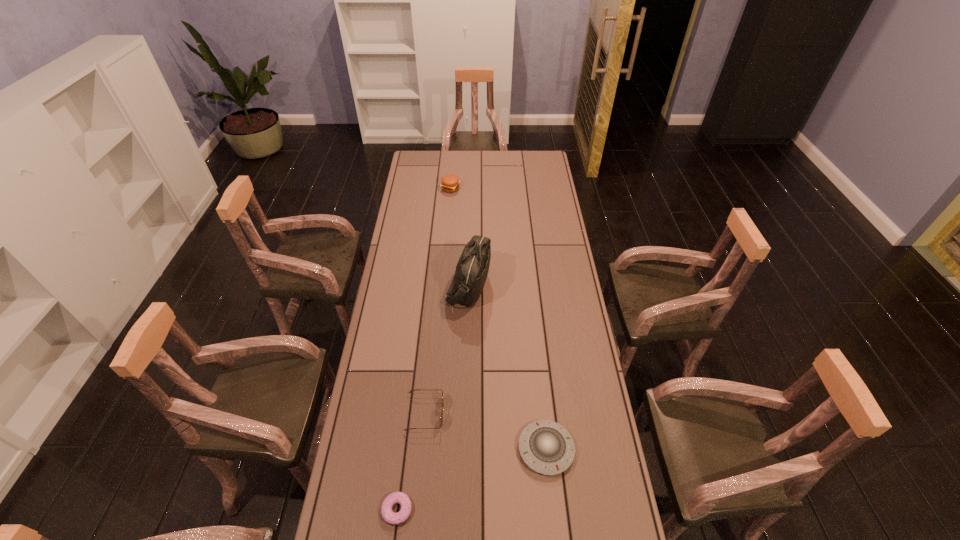
Where is `vacant space located on the lenses of the sunglasses`? vacant space located on the lenses of the sunglasses is located at coordinates (510, 413).

You are a GUI agent. You are given a task and a screenshot of the screen. Output one action in this format:
    pyautogui.click(x=<x>, y=<y>)
    Task: Click on the blank space located 0.140m on the back of the saucer
    The image size is (960, 540).
    Given the screenshot: What is the action you would take?
    pyautogui.click(x=540, y=385)

This screenshot has height=540, width=960. I want to click on vacant space located 0.060m on the back of the doughnut, so click(401, 472).

What are the coordinates of `sunglasses situated at the left edge` in the screenshot? It's located at (441, 417).

This screenshot has height=540, width=960. Find the location of `doughnut positioned at the left edge`. doughnut positioned at the left edge is located at coordinates (390, 517).

The image size is (960, 540). Find the location of `object at the right edge`. object at the right edge is located at coordinates (546, 447).

This screenshot has height=540, width=960. In the image, there is a desktop. Find the location of `free space at the left edge`. free space at the left edge is located at coordinates (370, 386).

Where is `vacant region at the right edge of the desktop`? This screenshot has width=960, height=540. vacant region at the right edge of the desktop is located at coordinates (564, 288).

You are a GUI agent. You are given a task and a screenshot of the screen. Output one action in this format:
    pyautogui.click(x=<x>, y=<y>)
    Task: Click on the free region at the far left corner of the desktop
    The width and height of the screenshot is (960, 540).
    Given the screenshot: What is the action you would take?
    pyautogui.click(x=422, y=172)

What are the coordinates of `free space between the fourth nearest object and the third tallest object` in the screenshot? It's located at (447, 348).